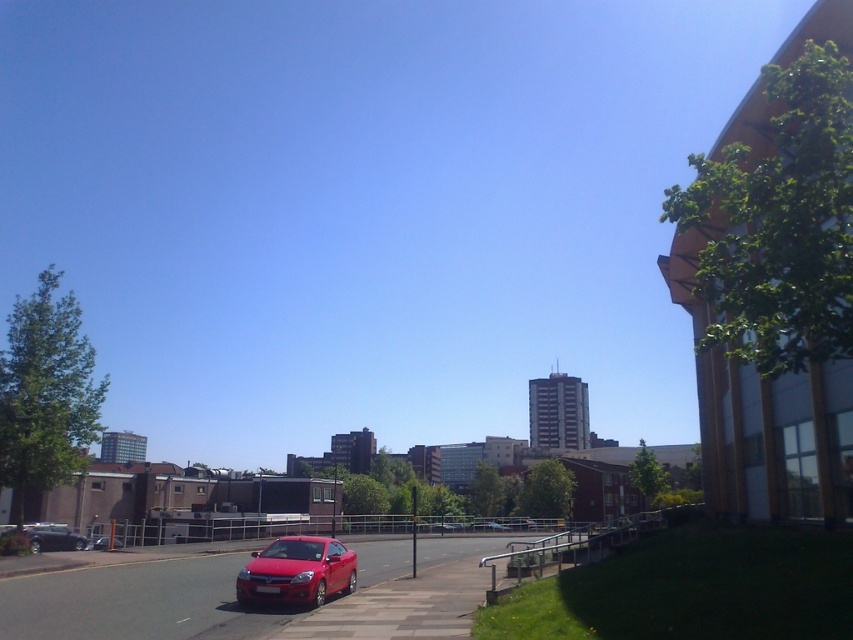
Is smooth asphalt road at lower center bigger than glossy red car at center?

Indeed, smooth asphalt road at lower center has a larger size compared to glossy red car at center.

Can you confirm if smooth asphalt road at lower center is thinner than glossy red car at center?

No.

At what (x,y) coordinates should I click in order to perform the action: click on smooth asphalt road at lower center. Please return your answer as a coordinate pair (x, y). Looking at the image, I should click on (136, 602).

Is smooth asphalt road at lower center positioned at the back of matte black car at lower left?

No, smooth asphalt road at lower center is closer to the viewer.

Which is below, smooth asphalt road at lower center or matte black car at lower left?

matte black car at lower left is below.

You are a GUI agent. You are given a task and a screenshot of the screen. Output one action in this format:
    pyautogui.click(x=<x>, y=<y>)
    Task: Click on the smooth asphalt road at lower center
    
    Given the screenshot: What is the action you would take?
    pyautogui.click(x=136, y=602)

Which is below, glossy red car at center or matte black car at lower left?

matte black car at lower left

Is glossy red car at center smaller than matte black car at lower left?

Correct, glossy red car at center occupies less space than matte black car at lower left.

The width and height of the screenshot is (853, 640). What do you see at coordinates (297, 572) in the screenshot? I see `glossy red car at center` at bounding box center [297, 572].

Locate an element on the screen. The height and width of the screenshot is (640, 853). glossy red car at center is located at coordinates (297, 572).